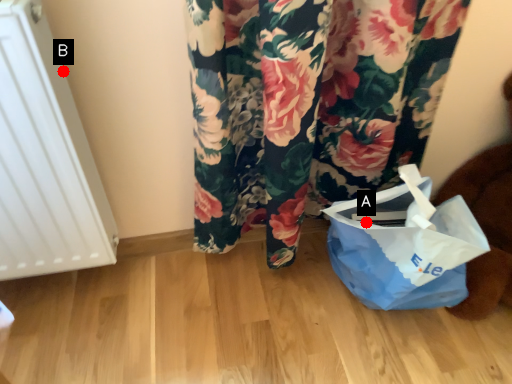
Question: Two points are circled on the image, labeled by A and B beside each circle. Which point appears closest to the camera in this image?

Choices:
 (A) A is closer
 (B) B is closer

Answer: (B)